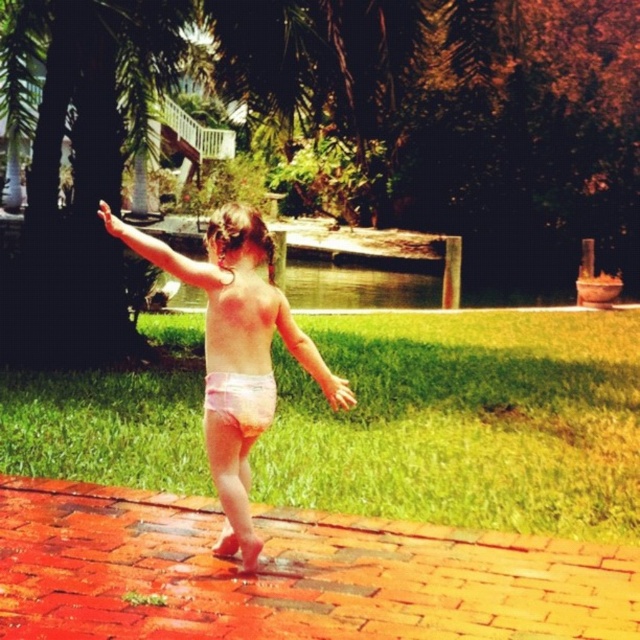
Where is the pink cloth diaper at center located in the image?

The pink cloth diaper at center is located at point (236, 304) in the image.